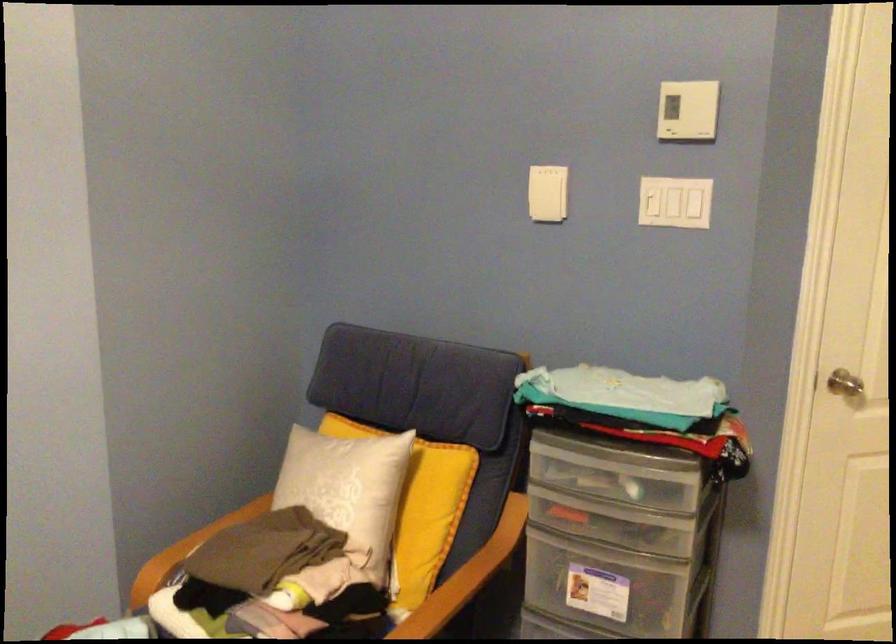
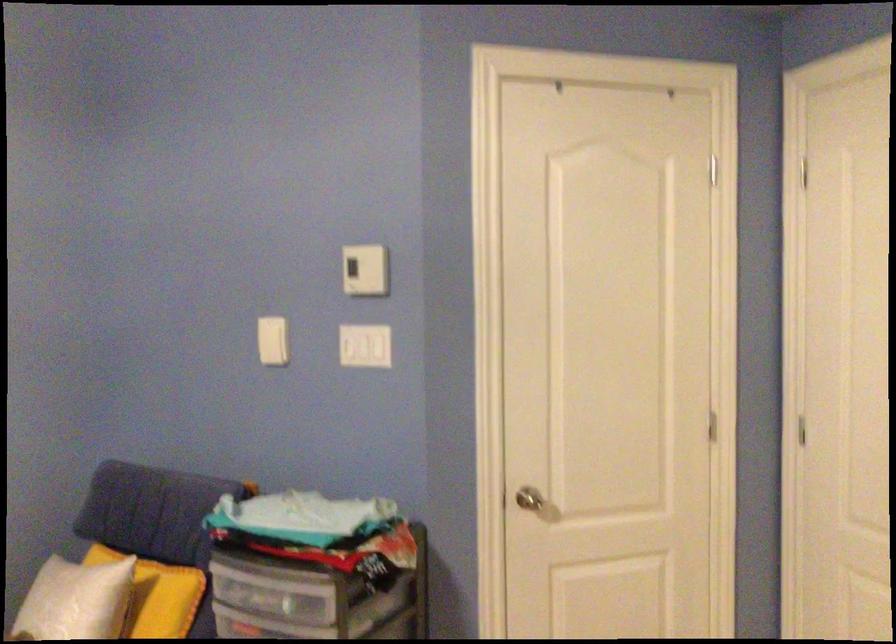
The point at [695,109] is marked in the first image. Where is the corresponding point in the second image?

(365, 270)